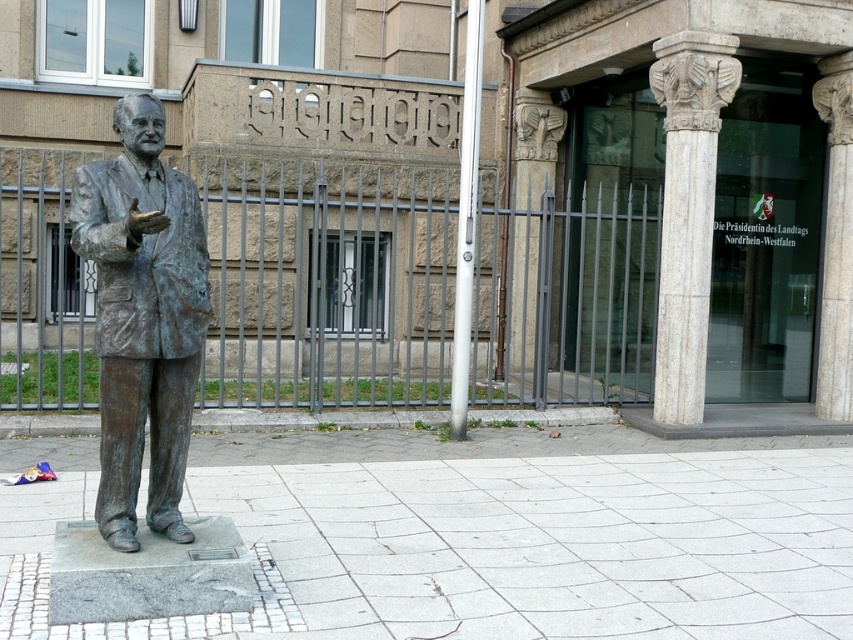
Consider the image. You are standing in front of the building and see the bronze statue at center and the white marble column at center. Which object is closer to you?

The bronze statue at center is closer to the viewer than the white marble column at center.

You are an architect inspecting the building. You notice the bronze statue at center and the white marble column at center. Which object is positioned higher up in the image?

The white marble column at center is positioned higher up in the image than the bronze statue at center because the bronze statue at center is located below it.